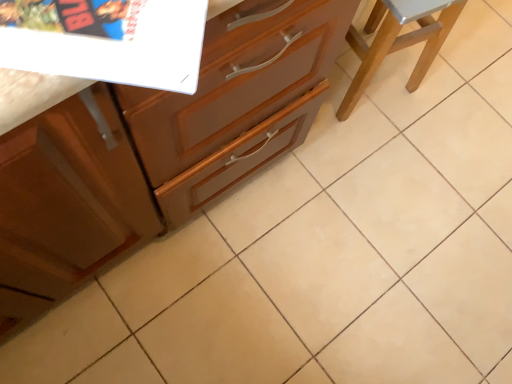
Find the location of `free space in front of wooden stool at right`. free space in front of wooden stool at right is located at coordinates (359, 155).